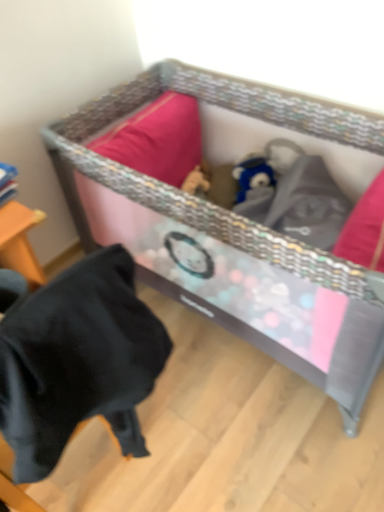
At what (x,y) coordinates should I click in order to perform the action: click on black fabric at lower left. Please return your answer as a coordinate pair (x, y). The width and height of the screenshot is (384, 512). Looking at the image, I should click on (77, 361).

This screenshot has height=512, width=384. Describe the element at coordinates (77, 361) in the screenshot. I see `black fabric at lower left` at that location.

Measure the distance between textured woven crib at center and camera.

textured woven crib at center is 37.04 inches away from camera.

You are a GUI agent. You are given a task and a screenshot of the screen. Output one action in this format:
    pyautogui.click(x=<x>, y=<y>)
    Task: Click on the textured woven crib at center
    The height and width of the screenshot is (512, 384).
    Given the screenshot: What is the action you would take?
    pyautogui.click(x=232, y=232)

This screenshot has width=384, height=512. What do you see at coordinates (232, 232) in the screenshot?
I see `textured woven crib at center` at bounding box center [232, 232].

Find the location of a particular element. The height and width of the screenshot is (512, 384). black fabric at lower left is located at coordinates (77, 361).

Does black fabric at lower left appear on the right side of textured woven crib at center?

Incorrect, black fabric at lower left is not on the right side of textured woven crib at center.

Considering their positions, is black fabric at lower left located in front of or behind textured woven crib at center?

Clearly, black fabric at lower left is in front of textured woven crib at center.

Does point (68, 340) come farther from viewer compared to point (134, 94)?

No, (68, 340) is in front of (134, 94).

From the image's perspective, which object appears higher, black fabric at lower left or textured woven crib at center?

textured woven crib at center appears higher in the image.

From a real-world perspective, who is located higher, black fabric at lower left or textured woven crib at center?

black fabric at lower left.

Considering the sizes of black fabric at lower left and textured woven crib at center in the image, is black fabric at lower left wider or thinner than textured woven crib at center?

Clearly, black fabric at lower left has less width compared to textured woven crib at center.

Which of these two, black fabric at lower left or textured woven crib at center, stands shorter?

With less height is textured woven crib at center.

Considering the sizes of objects black fabric at lower left and textured woven crib at center in the image provided, who is bigger, black fabric at lower left or textured woven crib at center?

Bigger between the two is textured woven crib at center.

Is black fabric at lower left surrounding textured woven crib at center?

Definitely not — textured woven crib at center is not inside black fabric at lower left.

Is black fabric at lower left far away from textured woven crib at center?

They are positioned close to each other.

Is textured woven crib at center at the back of black fabric at lower left?

black fabric at lower left does not have its back to textured woven crib at center.

Can you tell me how much black fabric at lower left and textured woven crib at center differ in facing direction?

88.4 degrees.

This screenshot has width=384, height=512. What are the coordinates of `clothing in front of the textured woven crib at center` in the screenshot? It's located at (77, 361).

Which object is positioned more to the right, textured woven crib at center or black fabric at lower left?

Positioned to the right is textured woven crib at center.

Which object is further away from the camera taking this photo, textured woven crib at center or black fabric at lower left?

textured woven crib at center is further from the camera.

Considering the points (94, 158) and (113, 311), which point is behind, point (94, 158) or point (113, 311)?

The point (94, 158) is more distant.

From the image's perspective, is textured woven crib at center below black fabric at lower left?

Incorrect, from the image's perspective, textured woven crib at center is higher than black fabric at lower left.

From a real-world perspective, which object rests below the other?

From a 3D spatial view, textured woven crib at center is below.

Between textured woven crib at center and black fabric at lower left, which one has larger width?

textured woven crib at center is wider.

Who is taller, textured woven crib at center or black fabric at lower left?

With more height is black fabric at lower left.

Does textured woven crib at center have a smaller size compared to black fabric at lower left?

Incorrect, textured woven crib at center is not smaller in size than black fabric at lower left.

Is textured woven crib at center spatially inside black fabric at lower left, or outside of it?

textured woven crib at center exists outside the volume of black fabric at lower left.

Are textured woven crib at center and black fabric at lower left far apart?

No, textured woven crib at center is not far away from black fabric at lower left.

Is textured woven crib at center turned away from black fabric at lower left?

No, black fabric at lower left is not at the back of textured woven crib at center.

How many degrees apart are the facing directions of textured woven crib at center and black fabric at lower left?

The facing directions of textured woven crib at center and black fabric at lower left are 88.4 degrees apart.

Where is `clothing that appears on the left of textured woven crib at center`? clothing that appears on the left of textured woven crib at center is located at coordinates (77, 361).

The width and height of the screenshot is (384, 512). I want to click on clothing in front of the textured woven crib at center, so click(77, 361).

In the image, there is a black fabric at lower left. Identify the location of infant bed below it (from a real-world perspective). (232, 232).